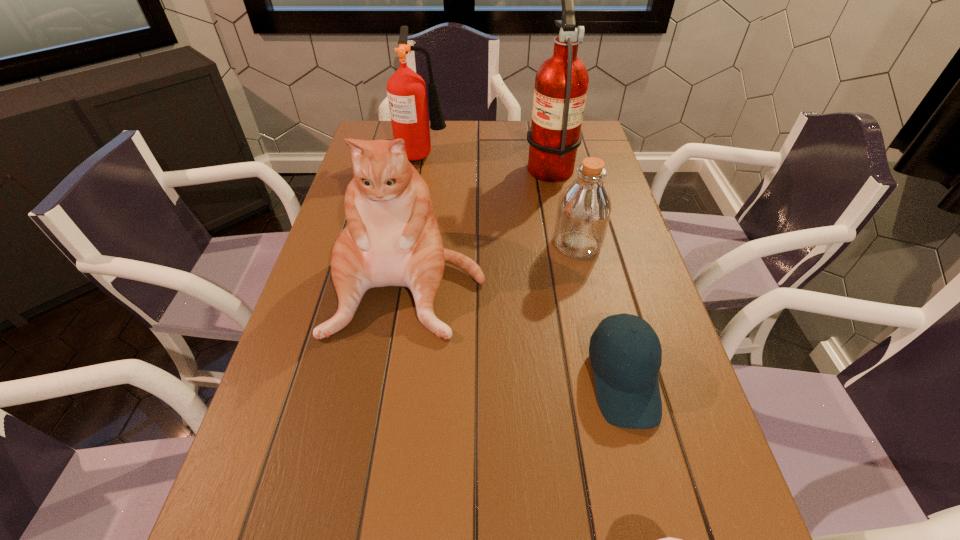
Identify the location of blank space at the left edge of the desktop. (300, 505).

I want to click on vacant space at the right edge, so 659,329.

The width and height of the screenshot is (960, 540). In the image, there is a desktop. What are the coordinates of `free region at the far right corner` in the screenshot? It's located at (592, 152).

Locate an element on the screen. This screenshot has width=960, height=540. blank region between the left fire extinguisher and the third shortest object is located at coordinates (500, 199).

The width and height of the screenshot is (960, 540). In order to click on vacant space in between the right fire extinguisher and the fifth tallest object in this screenshot , I will do `click(587, 272)`.

Locate an element on the screen. vacant space that is in between the shorter fire extinguisher and the baseball cap is located at coordinates (523, 267).

The image size is (960, 540). I want to click on object that is the closest to the third shortest object, so click(x=392, y=238).

At what (x,y) coordinates should I click in order to perform the action: click on object that is the fifth closest to the shortest object. Please return your answer as a coordinate pair (x, y). The height and width of the screenshot is (540, 960). Looking at the image, I should click on (406, 90).

This screenshot has height=540, width=960. Identify the location of free space that satisfies the following two spatial constraints: 1. on the nozzle and handle of the tallest object; 2. on the face of the cat. (572, 280).

At what (x,y) coordinates should I click in order to perform the action: click on vacant region that satisfies the following two spatial constraints: 1. on the back side of the bottle; 2. at the nozzle of the shorter fire extinguisher. Please return your answer as a coordinate pair (x, y). The height and width of the screenshot is (540, 960). Looking at the image, I should click on (556, 153).